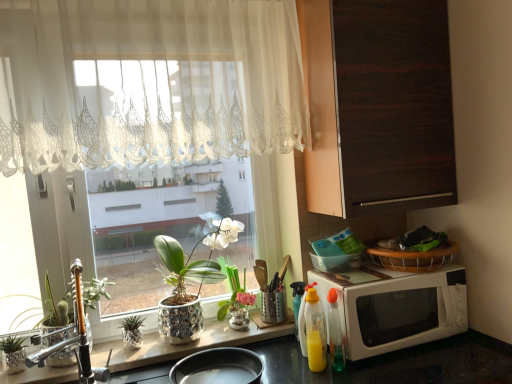
Locate an element on the screen. free space above shiny metallic pan at lower center (from a real-world perspective) is located at coordinates (190, 338).